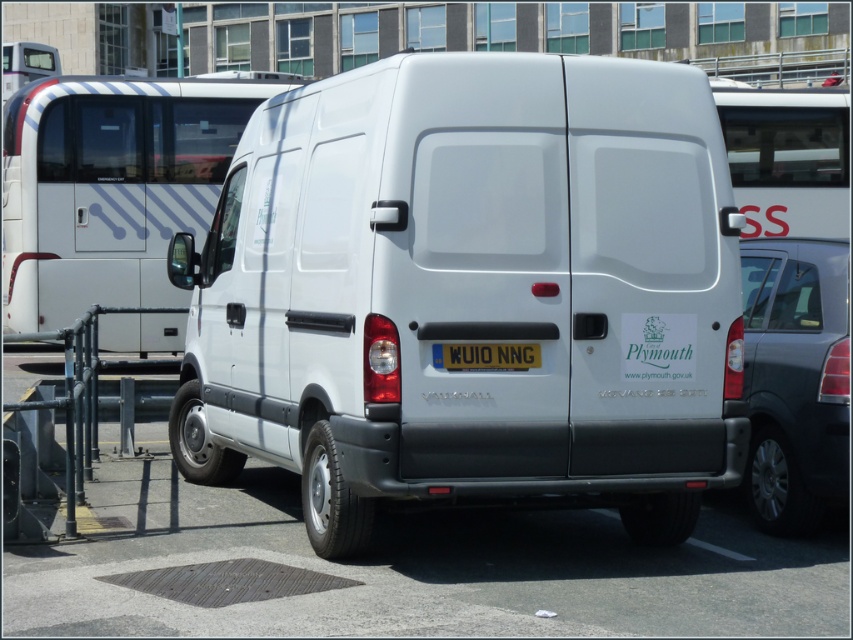
The image size is (853, 640). Find the location of `white matte van at center`. white matte van at center is located at coordinates (473, 292).

What do you see at coordinates (473, 292) in the screenshot? This screenshot has height=640, width=853. I see `white matte van at center` at bounding box center [473, 292].

Where is `white matte van at center`? The width and height of the screenshot is (853, 640). white matte van at center is located at coordinates (473, 292).

Does point (38, 237) lie in front of point (457, 364)?

No, (38, 237) is behind (457, 364).

Is point (80, 252) farther from camera compared to point (471, 365)?

That is True.

You are a GUI agent. You are given a task and a screenshot of the screen. Output one action in this format:
    pyautogui.click(x=<x>, y=<y>)
    Task: Click on the white glossy minibus at center
    
    Given the screenshot: What is the action you would take?
    pyautogui.click(x=112, y=186)

Is point (769, 364) closer to viewer compared to point (514, 369)?

That is False.

Does satin black car at right appear under white plastic license plate at center?

Yes, satin black car at right is below white plastic license plate at center.

You are a GUI agent. You are given a task and a screenshot of the screen. Output one action in this format:
    pyautogui.click(x=<x>, y=<y>)
    Task: Click on the satin black car at right
    
    Given the screenshot: What is the action you would take?
    pyautogui.click(x=795, y=380)